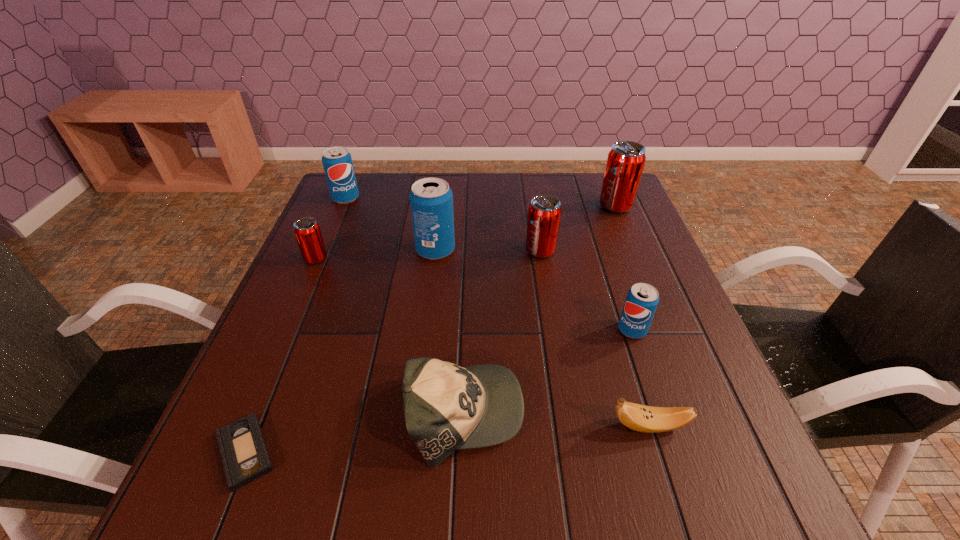
Identify the location of free space at the far edge. The image size is (960, 540). (537, 192).

In the image, there is a desktop. Where is `blank space at the near edge`? The height and width of the screenshot is (540, 960). blank space at the near edge is located at coordinates (412, 492).

In the image, there is a desktop. Where is `vacant space at the left edge`? vacant space at the left edge is located at coordinates (331, 325).

Identify the location of vacant area at the right edge. This screenshot has width=960, height=540. (695, 387).

In the image, there is a desktop. Identify the location of free region at the far left corner. (376, 181).

The width and height of the screenshot is (960, 540). I want to click on blank space at the far right corner of the desktop, so click(572, 176).

Where is `empty space that is in between the fourth object from right to left and the videotape`? This screenshot has height=540, width=960. empty space that is in between the fourth object from right to left and the videotape is located at coordinates (393, 352).

Locate an element on the screen. free space between the smallest red soda can and the banana is located at coordinates (483, 343).

Locate an element on the screen. This screenshot has width=960, height=540. blank region between the farthest blue soda can and the shortest object is located at coordinates (296, 326).

Where is `free space between the sixth farthest object and the banana`? The width and height of the screenshot is (960, 540). free space between the sixth farthest object and the banana is located at coordinates (640, 378).